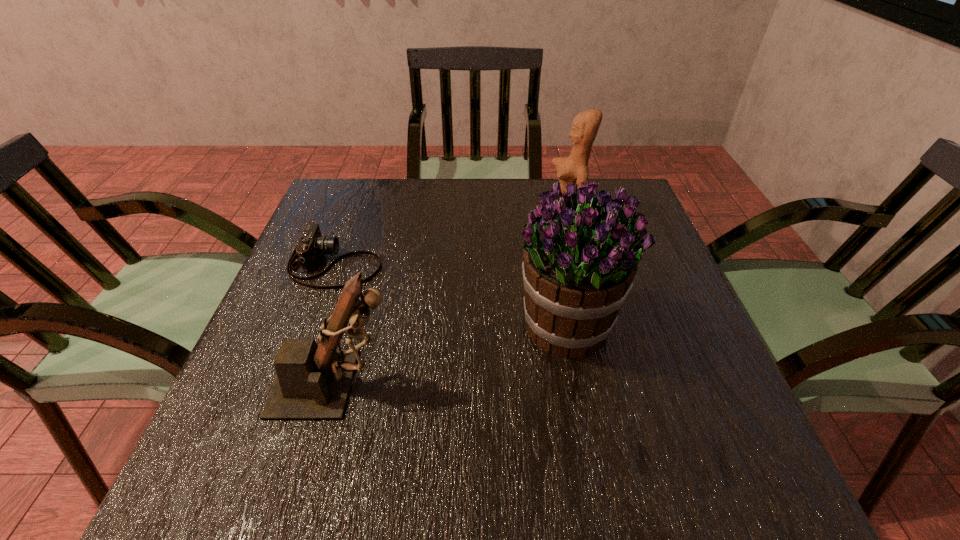
Locate an element on the screen. This screenshot has width=960, height=540. vacant space in between the nearer figurine and the bouquet is located at coordinates (451, 355).

Identify which object is the third nearest to the camera. Please provide its 2D coordinates. Your answer should be formatted as a tuple, i.e. [(x, y)], where the tuple contains the x and y coordinates of a point satisfying the conditions above.

[(574, 169)]

The image size is (960, 540). In order to click on object that is the third closest one to the camera in this screenshot , I will do `click(574, 169)`.

The image size is (960, 540). I want to click on free space in the image that satisfies the following two spatial constraints: 1. on the front-facing side of the camera; 2. on the right side of the bouquet, so click(313, 326).

Find the location of `vacant region that satisfies the following two spatial constraints: 1. on the front-facing side of the bouquet; 2. on the right side of the shortest object`. vacant region that satisfies the following two spatial constraints: 1. on the front-facing side of the bouquet; 2. on the right side of the shortest object is located at coordinates (313, 326).

Find the location of a particular element. The image size is (960, 540). vacant point that satisfies the following two spatial constraints: 1. on the front-facing side of the shortest object; 2. on the left side of the bouquet is located at coordinates (313, 326).

Locate an element on the screen. The width and height of the screenshot is (960, 540). vacant space that satisfies the following two spatial constraints: 1. on the front-facing side of the shortest object; 2. on the right side of the bouquet is located at coordinates (313, 326).

The width and height of the screenshot is (960, 540). What are the coordinates of `free location that satisfies the following two spatial constraints: 1. on the front-facing side of the bouquet; 2. on the right side of the shortest object` in the screenshot? It's located at (313, 326).